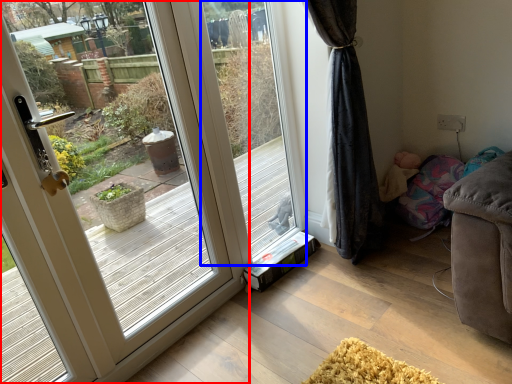
Question: Which object appears closest to the camera in this image, door (highlighted by a red box) or window screen (highlighted by a blue box)?

Choices:
 (A) door
 (B) window screen

Answer: (A)